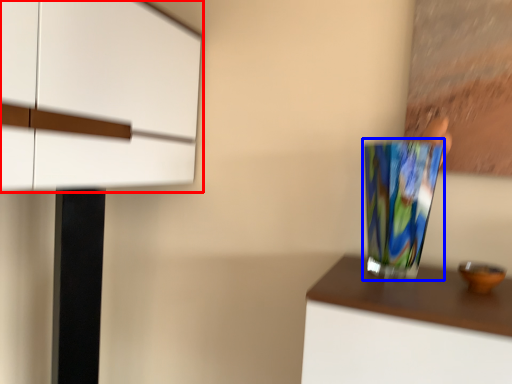
Question: Among these objects, which one is farthest to the camera, cabinetry (highlighted by a red box) or vase (highlighted by a blue box)?

Choices:
 (A) cabinetry
 (B) vase

Answer: (B)